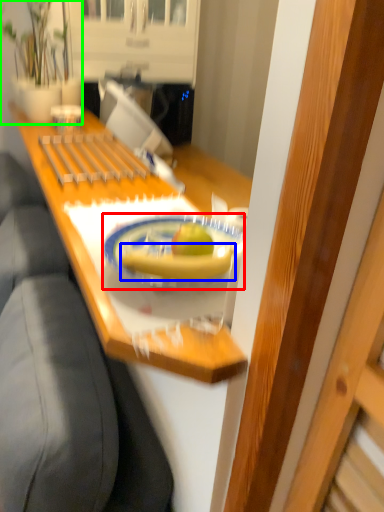
Question: Estimate the real-world distances between objects in this image. Which object is closer to plate (highlighted by a red box), banana (highlighted by a blue box) or houseplant (highlighted by a green box)?

Choices:
 (A) banana
 (B) houseplant

Answer: (A)